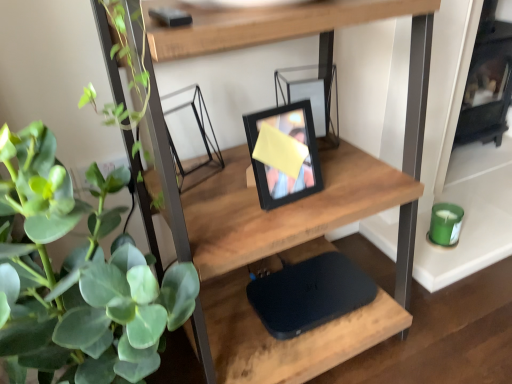
Question: Considering the relative positions of green matte plant at left and black matte picture frame at center in the image provided, is green matte plant at left behind black matte picture frame at center?

Choices:
 (A) yes
 (B) no

Answer: (B)

Question: Is green matte plant at left far from black matte picture frame at center?

Choices:
 (A) no
 (B) yes

Answer: (A)

Question: Considering the relative positions of green matte plant at left and black matte picture frame at center in the image provided, is green matte plant at left to the right of black matte picture frame at center from the viewer's perspective?

Choices:
 (A) no
 (B) yes

Answer: (A)

Question: Is green matte plant at left with black matte picture frame at center?

Choices:
 (A) no
 (B) yes

Answer: (A)

Question: From a real-world perspective, does green matte plant at left stand above black matte picture frame at center?

Choices:
 (A) yes
 (B) no

Answer: (B)

Question: Is green matte plant at left taller than black matte picture frame at center?

Choices:
 (A) no
 (B) yes

Answer: (B)

Question: From the image's perspective, does black matte picture frame at center appear lower than wooden shelf at center?

Choices:
 (A) yes
 (B) no

Answer: (B)

Question: Considering the relative sizes of black matte picture frame at center and wooden shelf at center in the image provided, is black matte picture frame at center smaller than wooden shelf at center?

Choices:
 (A) yes
 (B) no

Answer: (A)

Question: Would you say black matte picture frame at center is a long distance from wooden shelf at center?

Choices:
 (A) yes
 (B) no

Answer: (B)

Question: Can you confirm if black matte picture frame at center is bigger than wooden shelf at center?

Choices:
 (A) no
 (B) yes

Answer: (A)

Question: Does black matte picture frame at center lie behind wooden shelf at center?

Choices:
 (A) no
 (B) yes

Answer: (B)

Question: Does black matte picture frame at center touch wooden shelf at center?

Choices:
 (A) yes
 (B) no

Answer: (B)

Question: Is green matte plant at left turned away from black matte laptop at center?

Choices:
 (A) no
 (B) yes

Answer: (A)